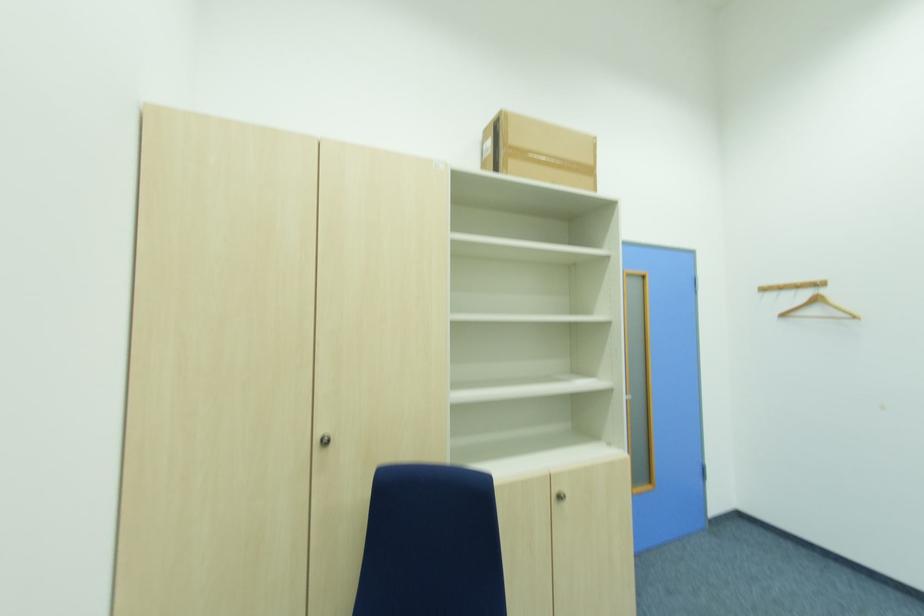
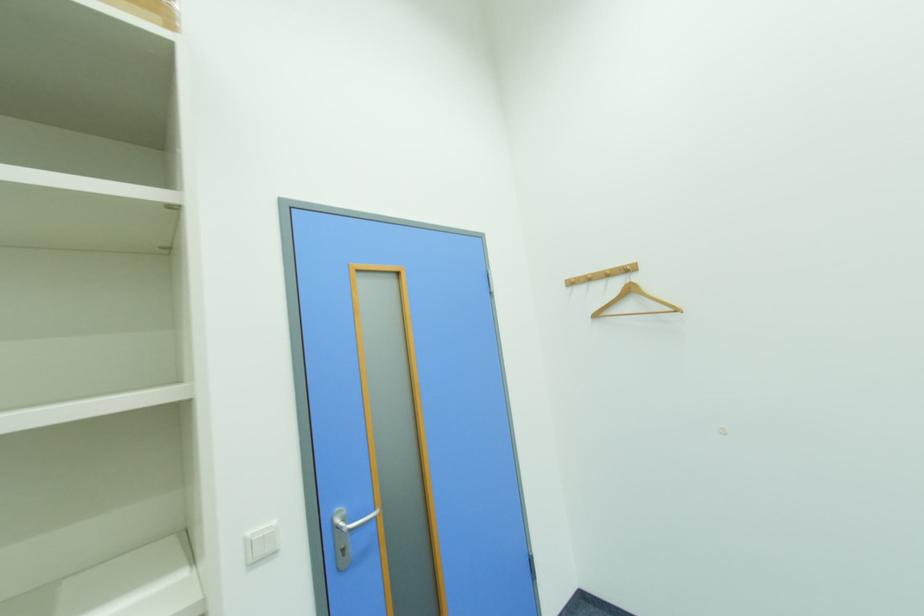
Locate, in the second image, the point that corresponds to point 787,317 in the first image.

(601, 317)